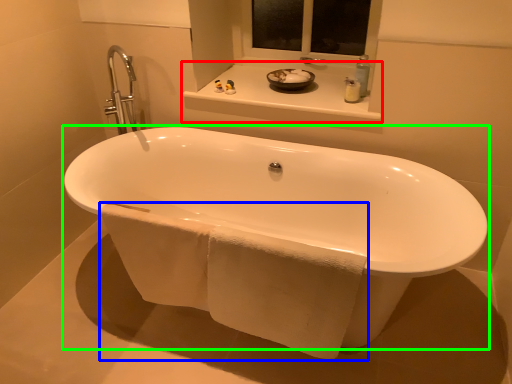
Question: Estimate the real-world distances between objects in this image. Which object is closer to window sill (highlighted by a red box), bath towel (highlighted by a blue box) or bathtub (highlighted by a green box)?

Choices:
 (A) bath towel
 (B) bathtub

Answer: (B)